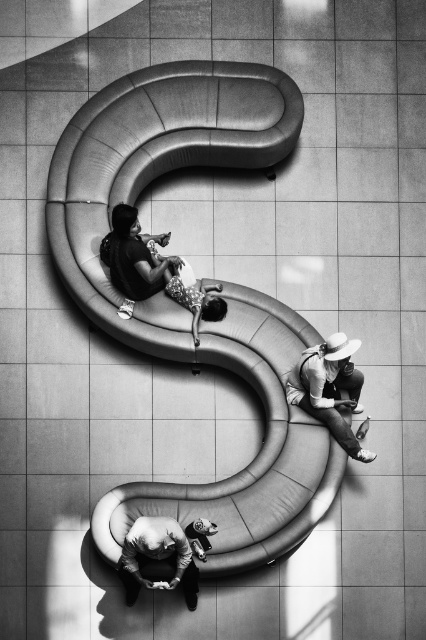
Question: Can you confirm if matte white hat at lower right is positioned below smooth leather jacket at lower center?

Choices:
 (A) yes
 (B) no

Answer: (B)

Question: Which object is the closest to the smooth leather jacket at lower center?

Choices:
 (A) matte white hat at lower right
 (B) matte black dress at center

Answer: (A)

Question: Is matte black dress at center positioned behind matte white hat at lower right?

Choices:
 (A) yes
 (B) no

Answer: (A)

Question: Which point is farther from the camera taking this photo?

Choices:
 (A) (339, 438)
 (B) (132, 268)

Answer: (A)

Question: Is matte white hat at lower right below smooth leather jacket at lower center?

Choices:
 (A) no
 (B) yes

Answer: (A)

Question: Based on their relative distances, which object is nearer to the matte black dress at center?

Choices:
 (A) matte white hat at lower right
 (B) smooth leather jacket at lower center

Answer: (A)